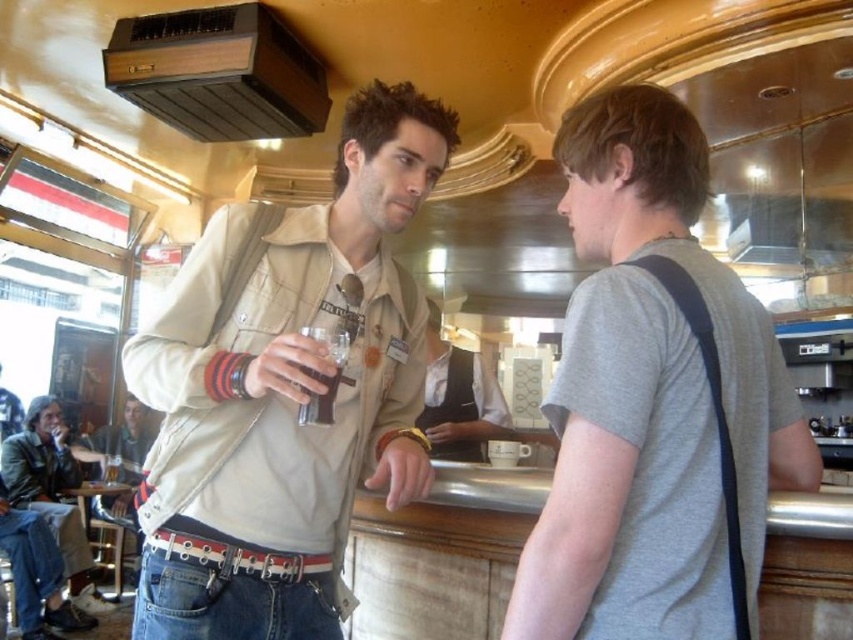
Which of these two, beige canvas jacket at center or dark brown liquid at center, stands shorter?

With less height is dark brown liquid at center.

Is beige canvas jacket at center to the left of dark brown liquid at center from the viewer's perspective?

Yes, beige canvas jacket at center is to the left of dark brown liquid at center.

Between point (402, 435) and point (329, 349), which one is positioned behind?

The point (402, 435) is more distant.

The image size is (853, 640). Identify the location of beige canvas jacket at center. (285, 390).

Can you confirm if gray matte t-shirt at center is wider than white uniform at center?

Yes, gray matte t-shirt at center is wider than white uniform at center.

Which is above, gray matte t-shirt at center or white uniform at center?

Positioned higher is gray matte t-shirt at center.

The image size is (853, 640). What do you see at coordinates (654, 401) in the screenshot?
I see `gray matte t-shirt at center` at bounding box center [654, 401].

Locate an element on the screen. The height and width of the screenshot is (640, 853). gray matte t-shirt at center is located at coordinates (654, 401).

Is beige canvas jacket at center below gray matte t-shirt at center?

No, beige canvas jacket at center is not below gray matte t-shirt at center.

Does beige canvas jacket at center have a greater width compared to gray matte t-shirt at center?

Yes, beige canvas jacket at center is wider than gray matte t-shirt at center.

This screenshot has height=640, width=853. Describe the element at coordinates (285, 390) in the screenshot. I see `beige canvas jacket at center` at that location.

Identify the location of beige canvas jacket at center. The height and width of the screenshot is (640, 853). (285, 390).